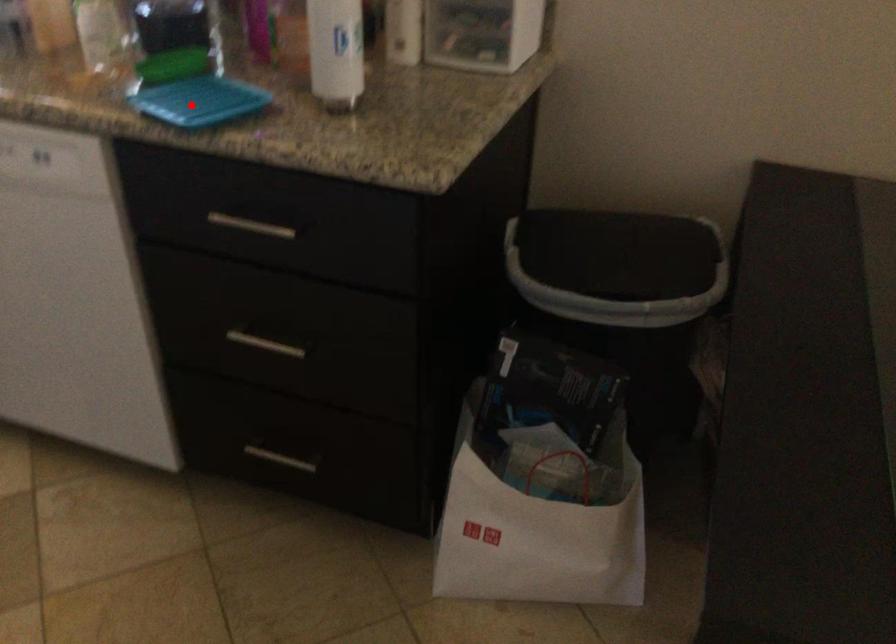
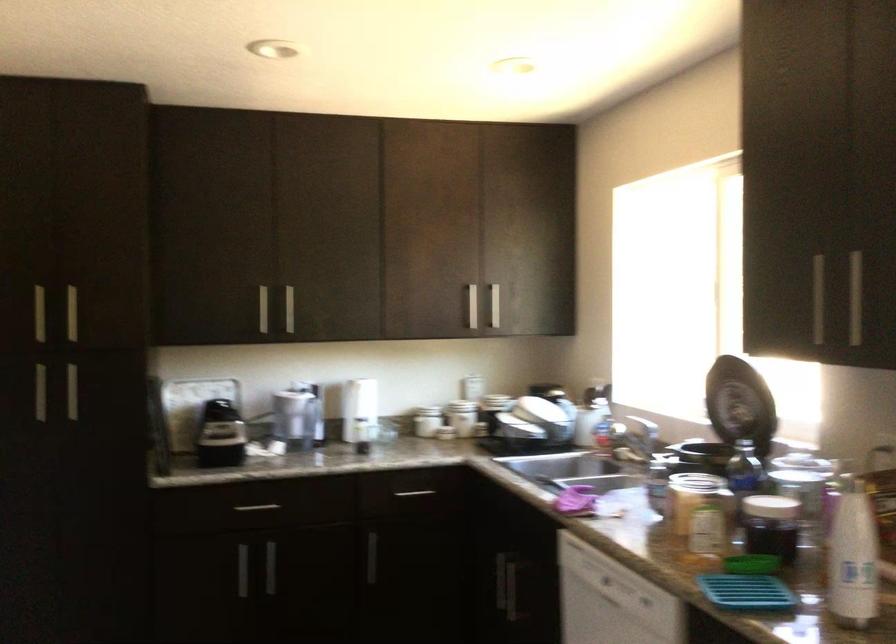
Question: I am providing you with two images of the same scene from different viewpoints. A red point is marked on the first image. Is the red point's position out of view in image 2?

Choices:
 (A) Yes
 (B) No

Answer: (B)